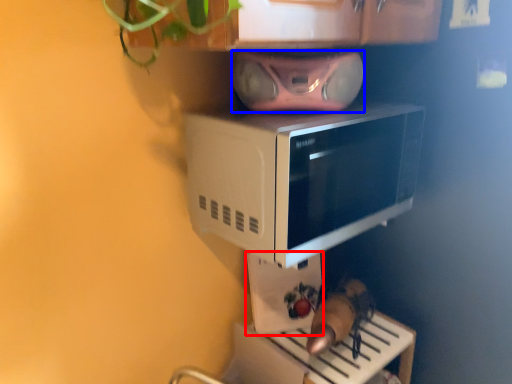
Question: Among these objects, which one is nearest to the camera, appliance (highlighted by a red box) or stereo (highlighted by a blue box)?

Choices:
 (A) appliance
 (B) stereo

Answer: (B)